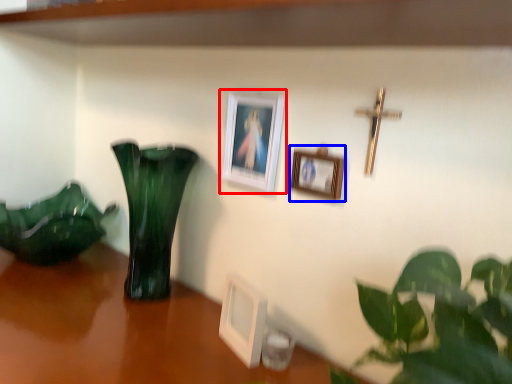
Question: Which point is closer to the camera, picture frame (highlighted by a red box) or picture frame (highlighted by a blue box)?

Choices:
 (A) picture frame
 (B) picture frame

Answer: (B)